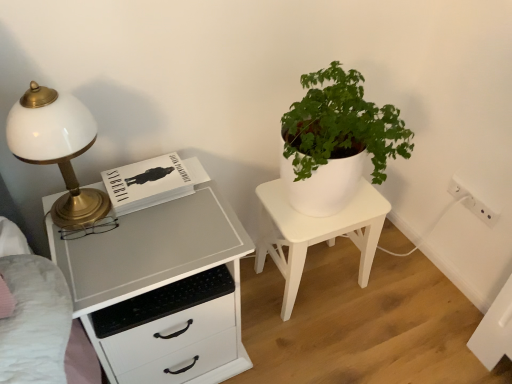
The image size is (512, 384). I want to click on vacant space to the right of white matte/porcelain nightstand at center, so click(401, 289).